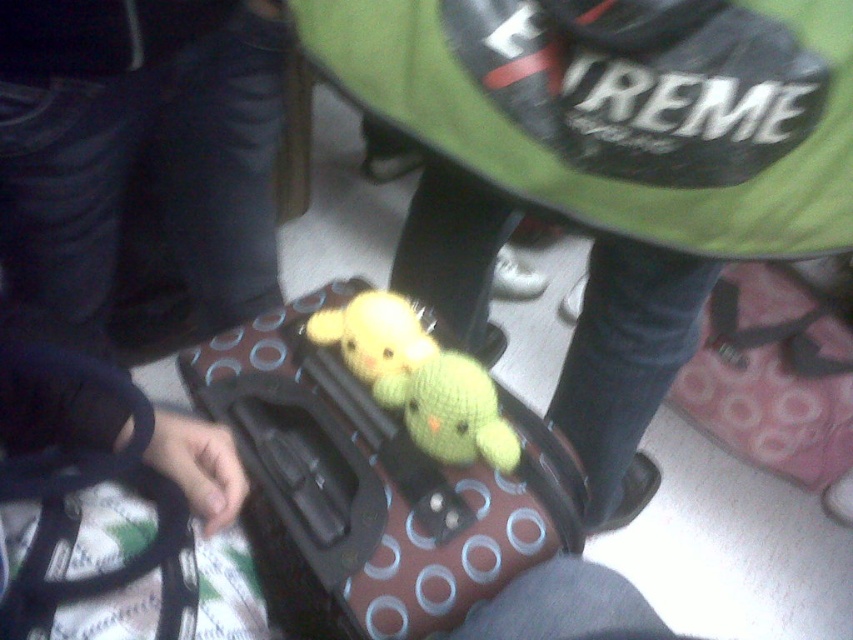
You are packing for a trip and see both the green knitted toy at center and the brown polka dot suitcase at center in the image. Which item should you pick up first if you want to place the green knitted toy into the suitcase?

The green knitted toy at center is located above the brown polka dot suitcase at center, so you should pick up the green knitted toy at center first and then place it into the brown polka dot suitcase at center.

Consider the image. You are organizing a childrens party and need to choose between the green knitted toy at center and the yellow knitted toy at center for a game that requires a larger toy. Which one should you pick?

The green knitted toy at center is bigger than the yellow knitted toy at center, so you should pick the green knitted toy at center for the game.

You are organizing a toy display in the living room and want to ensure that the green knitted toy at center and the yellow knitted toy at center are arranged properly. Which toy should you place on a higher shelf to avoid it being hidden by the other?

The green knitted toy at center is much taller than the yellow knitted toy at center, so you should place the green knitted toy at center on a higher shelf to prevent it from being hidden by the yellow one.